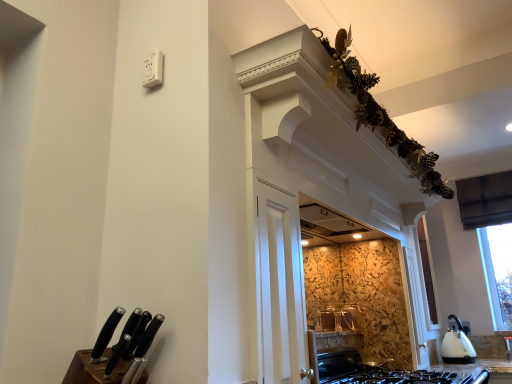
At what (x,y) coordinates should I click in order to perform the action: click on black matte knife at lower left, the second knife in the left-to-right sequence. Please return your answer as a coordinate pair (x, y). The height and width of the screenshot is (384, 512). Looking at the image, I should click on (142, 351).

The image size is (512, 384). Describe the element at coordinates (123, 341) in the screenshot. I see `black plastic knife at lower left, which is the 2th knife from right to left` at that location.

Locate an element on the screen. brown wooden knife block at lower left is located at coordinates (93, 370).

Is brown wooden knife block at lower left in front of black matte knife at lower left, the second knife in the left-to-right sequence?

Yes, brown wooden knife block at lower left is in front of black matte knife at lower left, the second knife in the left-to-right sequence.

The image size is (512, 384). What are the coordinates of `cabinetry below the black matte knife at lower left, the second knife in the left-to-right sequence (from the image's perspective)` in the screenshot? It's located at (93, 370).

Between brown wooden knife block at lower left and black matte knife at lower left, acting as the first knife starting from the right, which one has more height?

black matte knife at lower left, acting as the first knife starting from the right, is taller.

Does brown wooden knife block at lower left have a lesser width compared to black matte knife at lower left, acting as the first knife starting from the right?

No, brown wooden knife block at lower left is not thinner than black matte knife at lower left, acting as the first knife starting from the right.

From the image's perspective, is brown wooden knife block at lower left under white glossy electric kettle at lower right?

Actually, brown wooden knife block at lower left appears above white glossy electric kettle at lower right in the image.

Between brown wooden knife block at lower left and white glossy electric kettle at lower right, which one appears on the right side from the viewer's perspective?

Positioned to the right is white glossy electric kettle at lower right.

Can you confirm if brown wooden knife block at lower left is bigger than white glossy electric kettle at lower right?

No.

How many degrees apart are the facing directions of black plastic knife at lower left, which is the 2th knife from right to left, and black matte knife at lower left, the second knife in the left-to-right sequence?

The facing directions of black plastic knife at lower left, which is the 2th knife from right to left, and black matte knife at lower left, the second knife in the left-to-right sequence, are 0.0031 degrees apart.

From a real-world perspective, is black plastic knife at lower left, placed as the 1th knife when sorted from left to right, positioned above or below black matte knife at lower left, acting as the first knife starting from the right?

In terms of real-world spatial position, black plastic knife at lower left, placed as the 1th knife when sorted from left to right, is above black matte knife at lower left, acting as the first knife starting from the right.

Is black plastic knife at lower left, which is the 2th knife from right to left, facing away from black matte knife at lower left, the second knife in the left-to-right sequence?

Yes, black matte knife at lower left, the second knife in the left-to-right sequence, is at the back of black plastic knife at lower left, which is the 2th knife from right to left.

From the image's perspective, which is above, white glossy electric kettle at lower right or black matte gas stove at lower center?

black matte gas stove at lower center.

Which object is further away from the camera taking this photo, white glossy electric kettle at lower right or black matte gas stove at lower center?

white glossy electric kettle at lower right is more distant.

Is white glossy electric kettle at lower right facing away from black matte gas stove at lower center?

That's not correct — white glossy electric kettle at lower right is not looking away from black matte gas stove at lower center.

Is white glossy electric kettle at lower right at the left side of black matte gas stove at lower center?

Incorrect, white glossy electric kettle at lower right is not on the left side of black matte gas stove at lower center.

Is point (379, 378) positioned in front of point (108, 374)?

No, (379, 378) is behind (108, 374).

In the scene shown: Is black matte gas stove at lower center taller than black plastic knife at lower left, placed as the 1th knife when sorted from left to right?

Indeed, black matte gas stove at lower center has a greater height compared to black plastic knife at lower left, placed as the 1th knife when sorted from left to right.

Does black matte gas stove at lower center have a lesser width compared to black plastic knife at lower left, placed as the 1th knife when sorted from left to right?

Incorrect, the width of black matte gas stove at lower center is not less than that of black plastic knife at lower left, placed as the 1th knife when sorted from left to right.

Does black matte gas stove at lower center have a larger size compared to black plastic knife at lower left, which is the 2th knife from right to left?

Yes.

Is black matte knife at lower left, acting as the first knife starting from the right, far from white glossy electric kettle at lower right?

Yes.

From the image's perspective, who appears lower, black matte knife at lower left, acting as the first knife starting from the right, or white glossy electric kettle at lower right?

white glossy electric kettle at lower right appears lower in the image.

Considering the points (138, 343) and (463, 352), which point is behind, point (138, 343) or point (463, 352)?

The point (463, 352) is more distant.

Is black matte knife at lower left, acting as the first knife starting from the right, facing towards white glossy electric kettle at lower right?

No, black matte knife at lower left, acting as the first knife starting from the right, is not oriented towards white glossy electric kettle at lower right.

Is black matte knife at lower left, acting as the first knife starting from the right, to the right of black matte gas stove at lower center from the viewer's perspective?

In fact, black matte knife at lower left, acting as the first knife starting from the right, is to the left of black matte gas stove at lower center.

Is black matte knife at lower left, the second knife in the left-to-right sequence, aimed at black matte gas stove at lower center?

No, black matte knife at lower left, the second knife in the left-to-right sequence, is not facing towards black matte gas stove at lower center.

Considering the positions of point (123, 383) and point (450, 376), is point (123, 383) closer or farther from the camera than point (450, 376)?

Point (123, 383) appears to be closer to the viewer than point (450, 376).

I want to click on cabinetry that is under the black matte knife at lower left, acting as the first knife starting from the right (from a real-world perspective), so (93, 370).

The image size is (512, 384). In order to click on cabinetry above the white glossy electric kettle at lower right (from a real-world perspective) in this screenshot , I will do `click(93, 370)`.

Looking at the image, which one is located closer to black matte gas stove at lower center, brown wooden knife block at lower left or white glossy electric kettle at lower right?

The object closer to black matte gas stove at lower center is white glossy electric kettle at lower right.

Based on their spatial positions, is white glossy electric kettle at lower right or black plastic knife at lower left, placed as the 1th knife when sorted from left to right, further from black matte gas stove at lower center?

black plastic knife at lower left, placed as the 1th knife when sorted from left to right, lies further to black matte gas stove at lower center than the other object.

When comparing their distances from black plastic knife at lower left, which is the 2th knife from right to left, does brown wooden knife block at lower left or black matte knife at lower left, acting as the first knife starting from the right, seem further?

brown wooden knife block at lower left is positioned further to the anchor black plastic knife at lower left, which is the 2th knife from right to left.

Looking at the image, which one is located closer to black matte gas stove at lower center, black plastic knife at lower left, which is the 2th knife from right to left, or brown wooden knife block at lower left?

brown wooden knife block at lower left is closer to black matte gas stove at lower center.

Which object lies nearer to the anchor point brown wooden knife block at lower left, white glossy electric kettle at lower right or black matte gas stove at lower center?

Based on the image, black matte gas stove at lower center appears to be nearer to brown wooden knife block at lower left.

From the image, which object appears to be nearer to black matte gas stove at lower center, black matte knife at lower left, the second knife in the left-to-right sequence, or brown wooden knife block at lower left?

black matte knife at lower left, the second knife in the left-to-right sequence, is closer to black matte gas stove at lower center.

Considering their positions, is black matte knife at lower left, acting as the first knife starting from the right, positioned closer to white glossy electric kettle at lower right than black matte gas stove at lower center?

black matte gas stove at lower center lies closer to white glossy electric kettle at lower right than the other object.

When comparing their distances from black matte knife at lower left, the second knife in the left-to-right sequence, does brown wooden knife block at lower left or black matte gas stove at lower center seem closer?

brown wooden knife block at lower left is closer to black matte knife at lower left, the second knife in the left-to-right sequence.

This screenshot has height=384, width=512. Identify the location of gas stove located between black matte knife at lower left, the second knife in the left-to-right sequence, and white glossy electric kettle at lower right in the depth direction. (382, 372).

Find the location of `knife between brown wooden knife block at lower left and black matte knife at lower left, the second knife in the left-to-right sequence, from left to right`. knife between brown wooden knife block at lower left and black matte knife at lower left, the second knife in the left-to-right sequence, from left to right is located at coordinates (123, 341).

Image resolution: width=512 pixels, height=384 pixels. I want to click on gas stove positioned between brown wooden knife block at lower left and white glossy electric kettle at lower right from near to far, so click(382, 372).

I want to click on gas stove between black plastic knife at lower left, which is the 2th knife from right to left, and white glossy electric kettle at lower right from front to back, so click(382, 372).